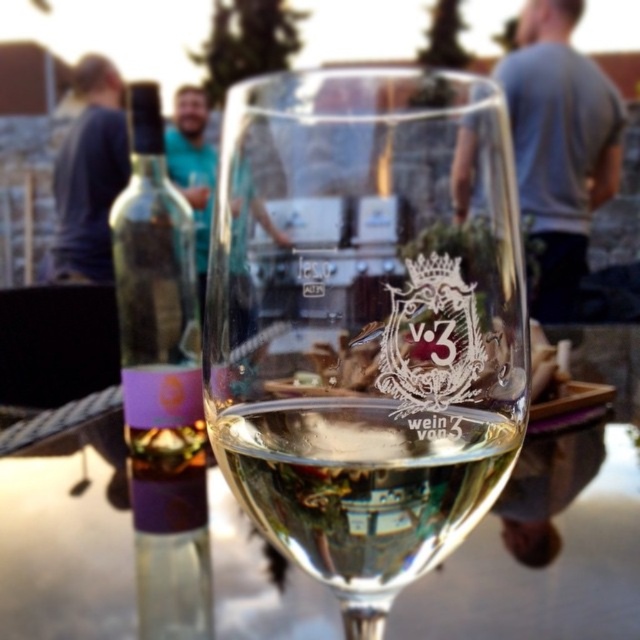
Is transparent glass at center smaller than blue fabric shirt at upper left?

No, transparent glass at center is not smaller than blue fabric shirt at upper left.

Which is behind, point (321, 625) or point (93, 60)?

The point (93, 60) is behind.

What are the coordinates of `transparent glass at center` in the screenshot? It's located at (541, 570).

Does clear glass wine glass at center have a lesser width compared to transparent glass at center?

Indeed, clear glass wine glass at center has a lesser width compared to transparent glass at center.

What do you see at coordinates (362, 326) in the screenshot? I see `clear glass wine glass at center` at bounding box center [362, 326].

Locate an element on the screen. This screenshot has width=640, height=640. clear glass wine glass at center is located at coordinates click(x=362, y=326).

The height and width of the screenshot is (640, 640). What do you see at coordinates (541, 570) in the screenshot?
I see `transparent glass at center` at bounding box center [541, 570].

Does point (51, 531) come behind point (144, 525)?

No, (51, 531) is closer to viewer.

In order to click on transparent glass at center in this screenshot , I will do `click(541, 570)`.